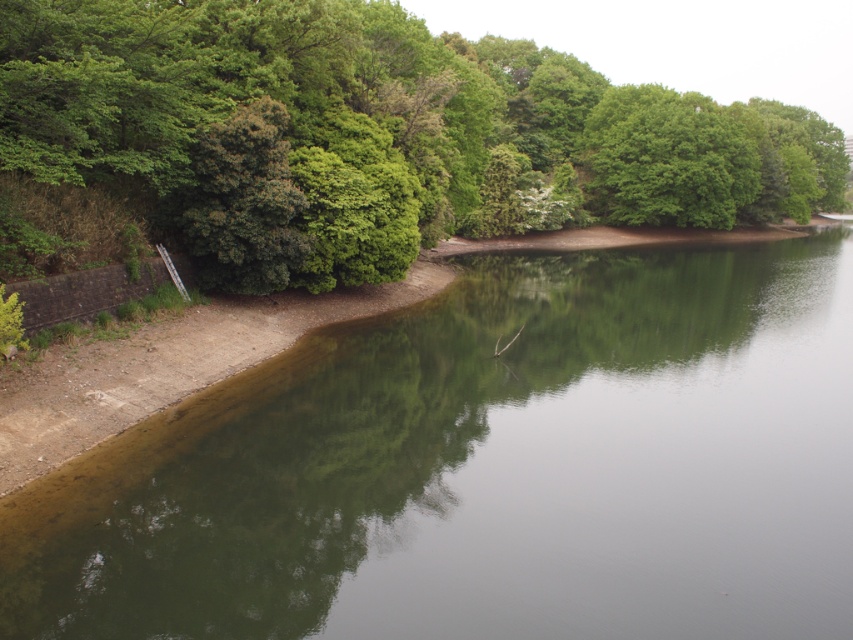
Which of these two, green reflective water at center or green leafy tree at upper center, stands taller?

Standing taller between the two is green leafy tree at upper center.

Does green reflective water at center appear over green leafy tree at upper center?

Actually, green reflective water at center is below green leafy tree at upper center.

Who is more forward, (397, 480) or (606, 134)?

Positioned in front is point (397, 480).

Locate an element on the screen. green reflective water at center is located at coordinates (486, 467).

Does point (618, 172) come farther from viewer compared to point (219, 348)?

That is True.

Who is higher up, green leafy tree at upper left or dull concrete shoreline at lower left?

green leafy tree at upper left

Between point (4, 97) and point (434, 262), which one is positioned behind?

Point (434, 262)

Where is `green leafy tree at upper left`? green leafy tree at upper left is located at coordinates (357, 140).

Can you confirm if green leafy tree at upper left is thinner than green leafy tree at upper center?

No, green leafy tree at upper left is not thinner than green leafy tree at upper center.

Describe the element at coordinates (357, 140) in the screenshot. I see `green leafy tree at upper left` at that location.

The image size is (853, 640). I want to click on green leafy tree at upper left, so click(x=357, y=140).